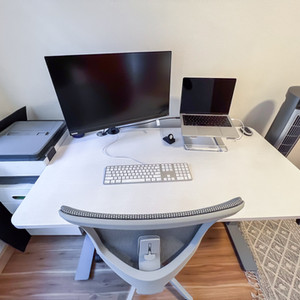
Locate an element on the screen. Image resolution: width=300 pixels, height=300 pixels. cord is located at coordinates (267, 265), (116, 156), (243, 122).